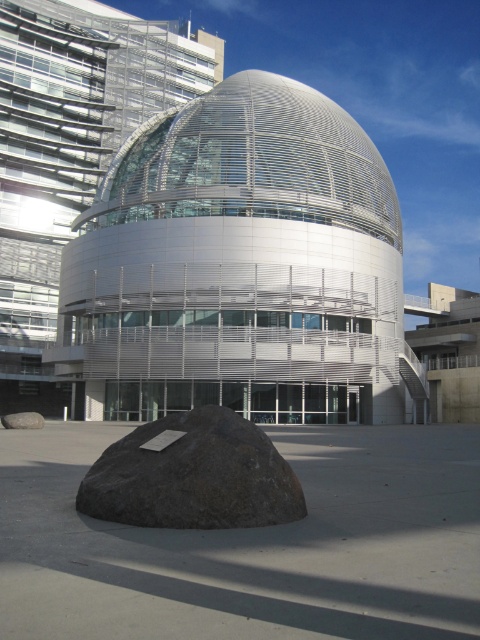
Looking at this image, you are an architect evaluating the placement of the dark gray stone boulder at lower center and the gray rough rock at lower center in front of the modern building. Which object is taller?

The gray rough rock at lower center is taller than the dark gray stone boulder at lower center.